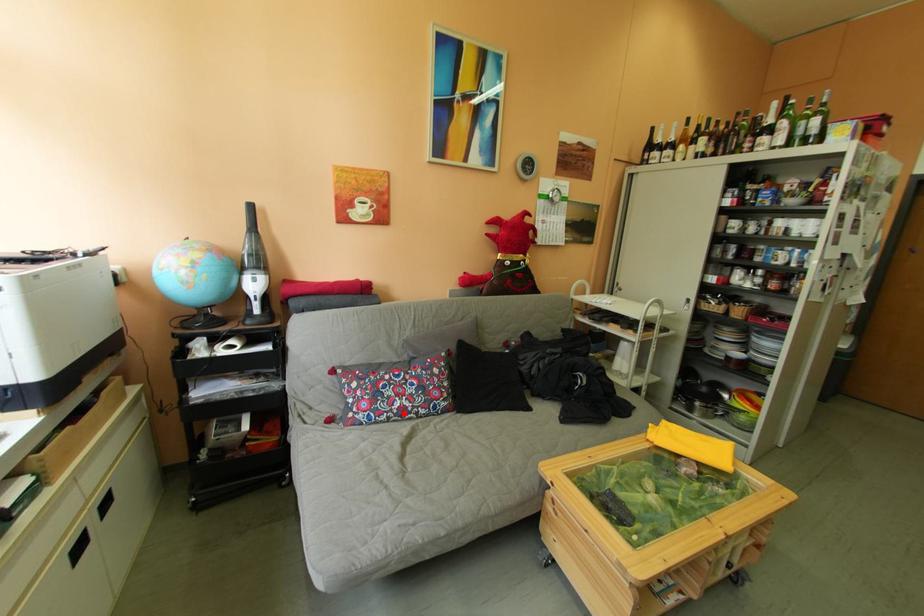
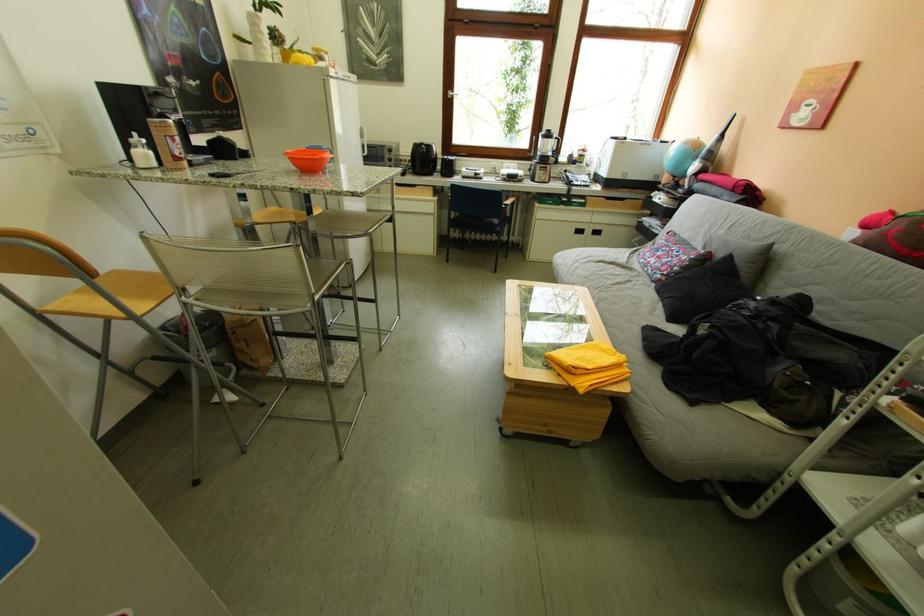
In the second image, find the point that corresponds to the highlighted location in the first image.

(659, 262)